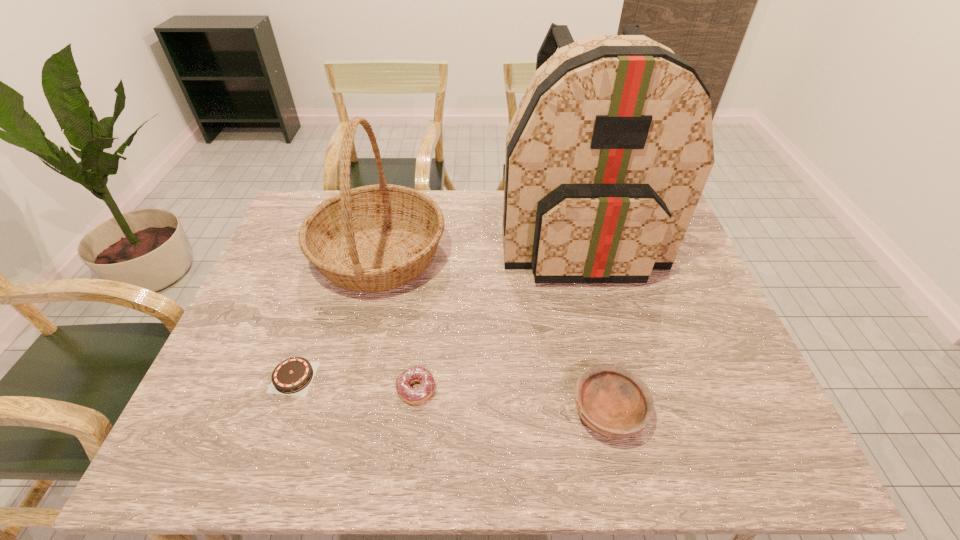
Where is `backpack situated at the far edge`? Image resolution: width=960 pixels, height=540 pixels. backpack situated at the far edge is located at coordinates (607, 155).

At what (x,y) coordinates should I click in order to perform the action: click on basket at the far edge. Please return your answer as a coordinate pair (x, y). This screenshot has height=540, width=960. Looking at the image, I should click on (373, 238).

The height and width of the screenshot is (540, 960). Identify the location of object at the near edge. (612, 401).

I want to click on basket situated at the left edge, so click(x=373, y=238).

Where is `chocolate cake positioned at the left edge`? The image size is (960, 540). chocolate cake positioned at the left edge is located at coordinates (293, 376).

Image resolution: width=960 pixels, height=540 pixels. I want to click on object that is at the right edge, so click(x=607, y=155).

The height and width of the screenshot is (540, 960). Identify the location of object located in the far left corner section of the desktop. (373, 238).

This screenshot has height=540, width=960. Identify the location of object present at the far right corner. (607, 155).

Locate an element on the screen. The height and width of the screenshot is (540, 960). vacant space at the near edge of the desktop is located at coordinates (308, 457).

The image size is (960, 540). Identify the location of vacant region at the left edge of the desktop. point(243,334).